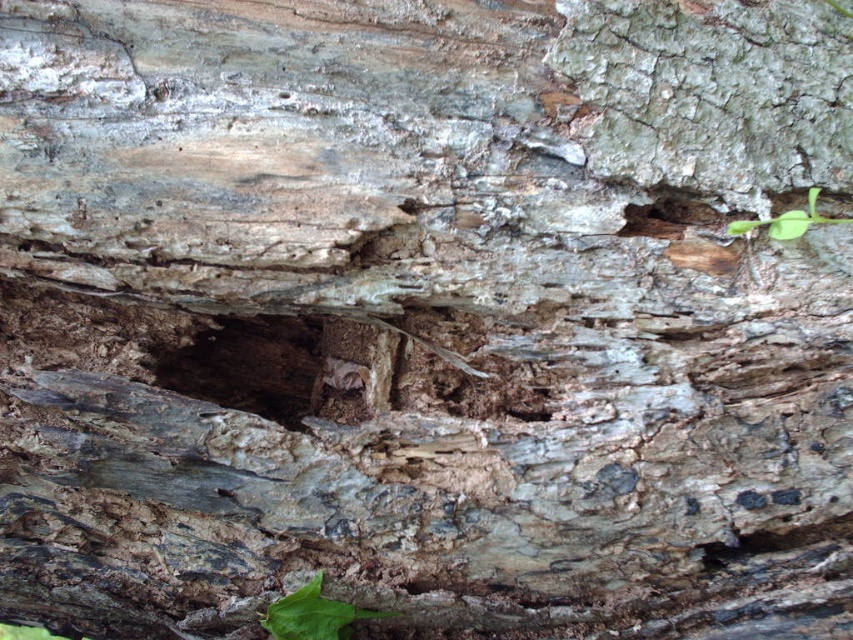
Is dark wood hole at center wider than green leafy plant at upper right?

Yes.

Who is shorter, dark wood hole at center or green leafy plant at upper right?

Standing shorter between the two is green leafy plant at upper right.

Is point (231, 378) behind point (738, 234)?

That is True.

Locate an element on the screen. dark wood hole at center is located at coordinates (245, 364).

Who is lower down, dark wood hole at center or green leafy plant at lower center?

green leafy plant at lower center

Is point (285, 374) closer to viewer compared to point (334, 616)?

No.

Where is `dark wood hole at center`? dark wood hole at center is located at coordinates (245, 364).

Between green leafy plant at lower center and green leafy plant at upper right, which one is positioned higher?

Positioned higher is green leafy plant at upper right.

Who is positioned more to the right, green leafy plant at lower center or green leafy plant at upper right?

From the viewer's perspective, green leafy plant at upper right appears more on the right side.

Is point (279, 604) less distant than point (825, 218)?

Yes.

Find the location of a particular element. green leafy plant at lower center is located at coordinates (312, 614).